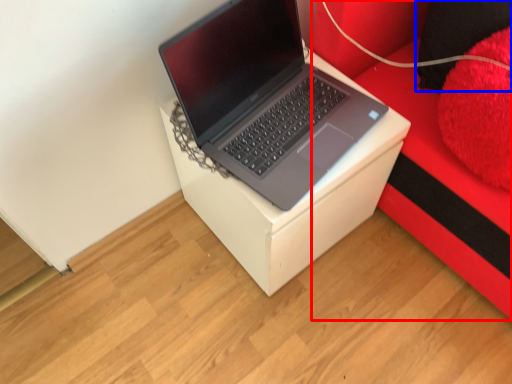
Question: Which point is further to the camera, furniture (highlighted by a red box) or pillow (highlighted by a blue box)?

Choices:
 (A) furniture
 (B) pillow

Answer: (B)